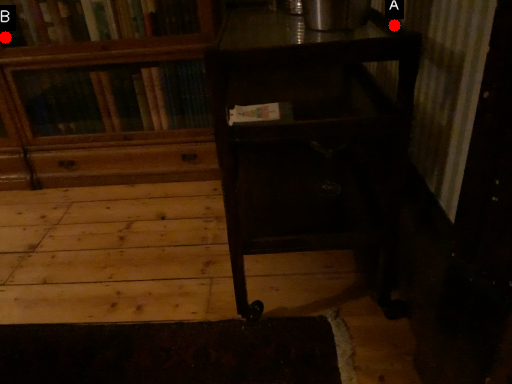
Question: Two points are circled on the image, labeled by A and B beside each circle. Among these points, which one is farthest from the camera?

Choices:
 (A) A is further
 (B) B is further

Answer: (B)